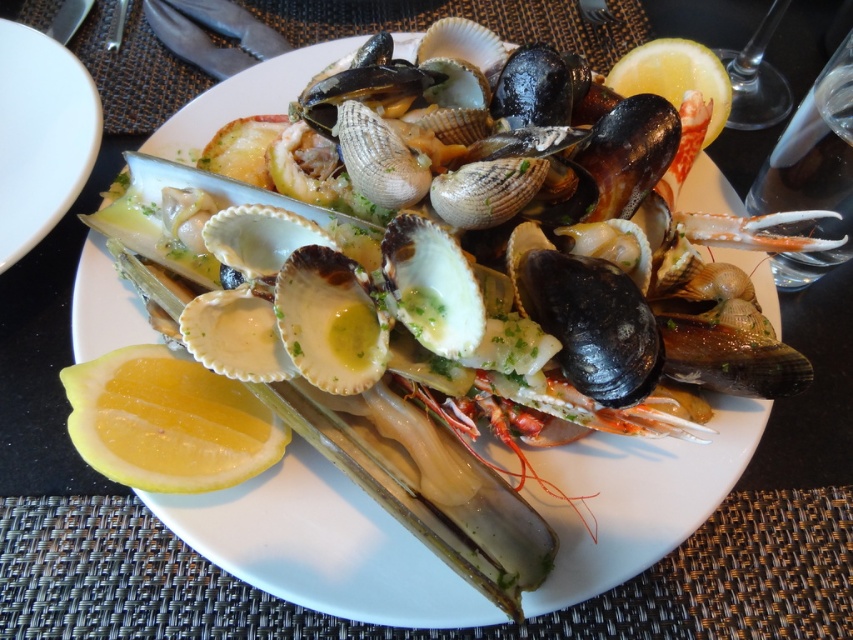
Looking at this image, you are a photographer trying to capture the perfect shot of the seafood platter. You need to focus on the point at coordinate point (151, 436). If your camera has a depth of field that can focus clearly up to 50 centimeters, will the point be in focus?

The point (151, 436) is 55.72 centimeters away from the camera, which exceeds the camera depth of field limit of 50 centimeters. Therefore, the point will not be in focus.

You are a food critic sitting at a table with the white glossy plate at upper left and the yellow matte lemon at upper right. You want to pick up the lemon to squeeze it over your dish. Which object should you reach for first to get the lemon?

You should reach for the yellow matte lemon at upper right first because the white glossy plate at upper left is closer to you, but the lemon is farther away. Wait, no, the description says the plate is closer to the viewer than the lemon. So to reach the lemon, you need to go past the plate? Hmm, maybe the question is confusing. Let me think again. The plate is closer, so the lemon is behind it? Therefore, to get the lemon, you have to move the plate first? Or maybe the lemon is on the upper right, so the

You are a food critic evaluating this seafood platter. You need to reach for the yellow juicy lemon at lower left to squeeze over the dish. Based on its position, can you estimate where exactly it is located on the plate?

The yellow juicy lemon at lower left is located at point coordinates of 0.661 on the x axis and 0.198 on the y axis.